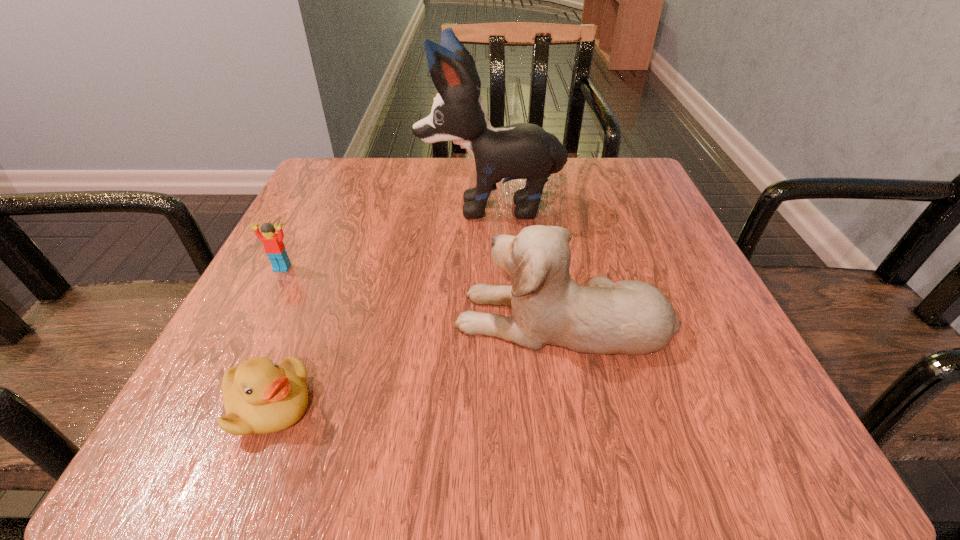
Where is `vacant space situated 0.290m on the front-facing side of the nearer puppy`? vacant space situated 0.290m on the front-facing side of the nearer puppy is located at coordinates coord(262,318).

Find the location of `vacant space located on the front-facing side of the nearer puppy`. vacant space located on the front-facing side of the nearer puppy is located at coordinates (361, 318).

Locate an element on the screen. The width and height of the screenshot is (960, 540). blank area located on the face of the third nearest object is located at coordinates (236, 358).

Where is `blank area located on the front-facing side of the duckling`? Image resolution: width=960 pixels, height=540 pixels. blank area located on the front-facing side of the duckling is located at coordinates (589, 406).

Locate an element on the screen. This screenshot has width=960, height=540. object present at the far edge is located at coordinates (526, 151).

Where is `object that is positioned at the near edge`? object that is positioned at the near edge is located at coordinates (260, 397).

What are the coordinates of `Lego located at the left edge` in the screenshot? It's located at (274, 247).

Where is `duckling that is at the left edge`? duckling that is at the left edge is located at coordinates point(260,397).

In order to click on object at the right edge in this screenshot , I will do `click(631, 317)`.

At what (x,y) coordinates should I click in order to perform the action: click on object situated at the near left corner. Please return your answer as a coordinate pair (x, y). Image resolution: width=960 pixels, height=540 pixels. Looking at the image, I should click on (260, 397).